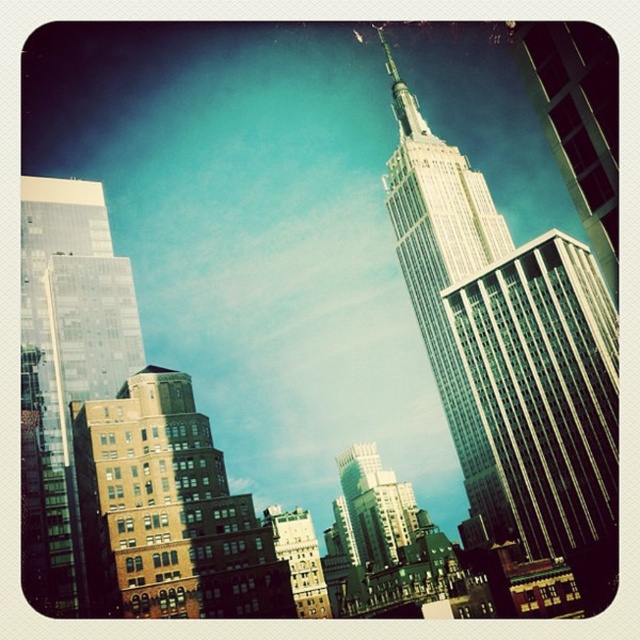
Question: Is the position of glassy reflective skyscraper at left less distant than that of white glass tower at center?

Choices:
 (A) yes
 (B) no

Answer: (A)

Question: In this image, where is brown brick building at lower left located relative to white glass tower at center?

Choices:
 (A) right
 (B) left

Answer: (B)

Question: From the image, what is the correct spatial relationship of brown brick building at lower left in relation to white glass tower at center?

Choices:
 (A) above
 (B) below

Answer: (B)

Question: Which point is closer to the camera?

Choices:
 (A) (490, 225)
 (B) (237, 616)
 (C) (593, 84)
 (D) (64, 356)

Answer: (C)

Question: Estimate the real-world distances between objects in this image. Which object is closer to the white glass tower at center?

Choices:
 (A) brown brick building at lower left
 (B) glassy reflective skyscraper at left
 (C) glassy skyscraper at upper right

Answer: (C)

Question: Which of the following is the farthest from the observer?

Choices:
 (A) brown brick building at lower left
 (B) glassy reflective skyscraper at left
 (C) glassy skyscraper at upper right
 (D) white glass tower at center

Answer: (D)